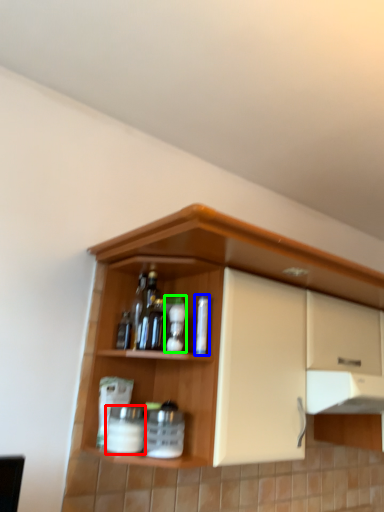
Question: Which object is the closest to the beverage (highlighted by a red box)? Choose among these: bottle (highlighted by a blue box) or bottle (highlighted by a green box).

Choices:
 (A) bottle
 (B) bottle

Answer: (B)